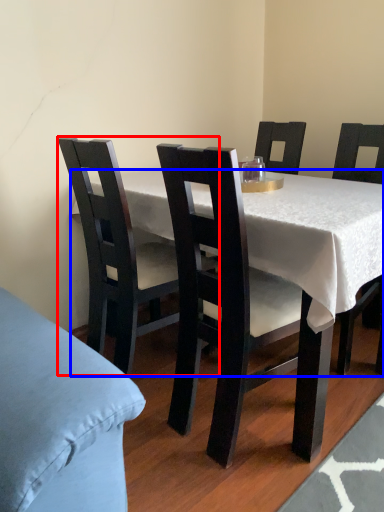
Question: Which object appears farthest to the camera in this image, chair (highlighted by a red box) or desk (highlighted by a blue box)?

Choices:
 (A) chair
 (B) desk

Answer: (A)